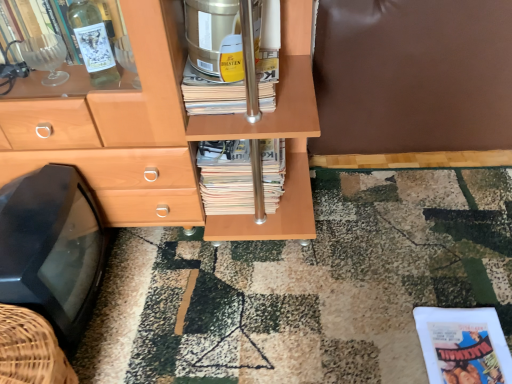
Locate an element on the screen. The width and height of the screenshot is (512, 384). free point above matte white paperback book at lower right (from a real-world perspective) is located at coordinates (466, 349).